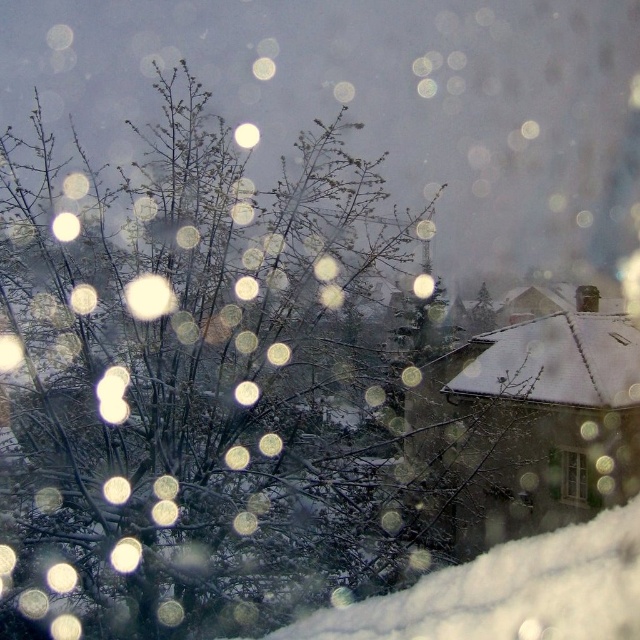
You are standing in a room with a window showing a winter scene. You notice two points on the window glass at coordinates point (544, 634) and point (572, 484). Which point is closer to you?

Point (544, 634) is in front of point (572, 484), so it is closer to you.

You are standing inside a house and looking through the window. You see the white fluffy snow at lower right and the clear glass window at lower right. Which one is closer to you?

The white fluffy snow at lower right is closer to you because it is positioned on the left side of the clear glass window at lower right, indicating it is in front of the window.